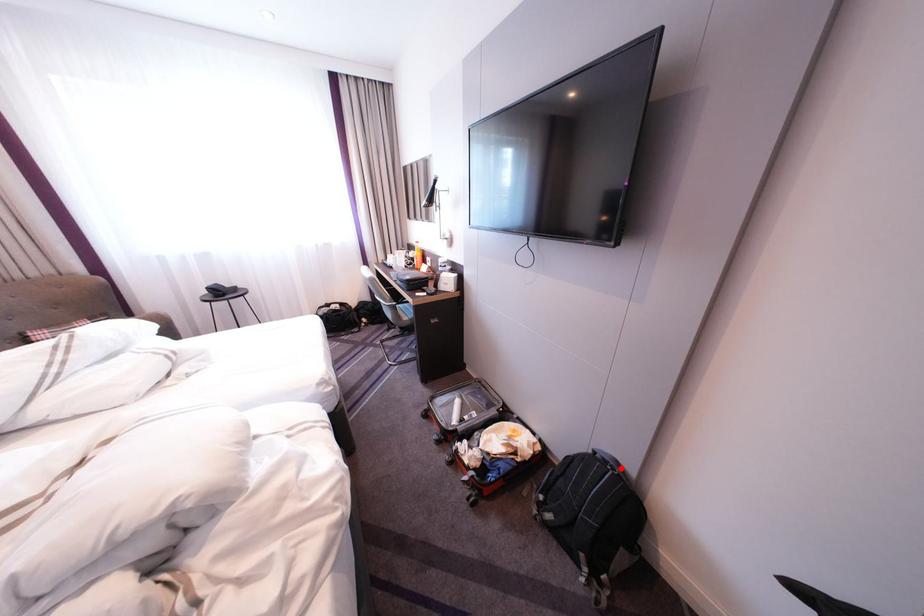
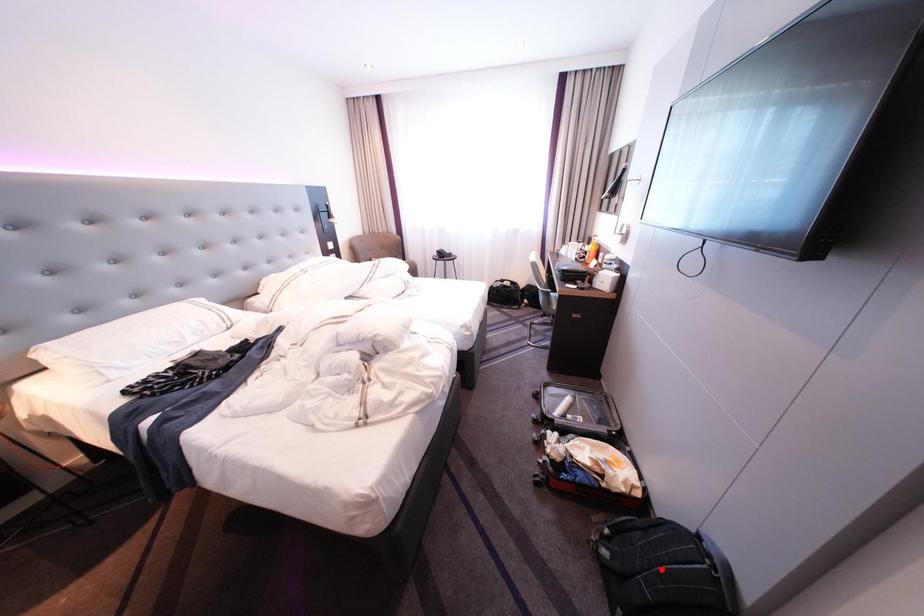
I am providing you with two images of the same scene from different viewpoints. A red point is marked on the first image and another point is marked on the second image. Is the marked point in image1 the same physical position as the marked point in image2?

No